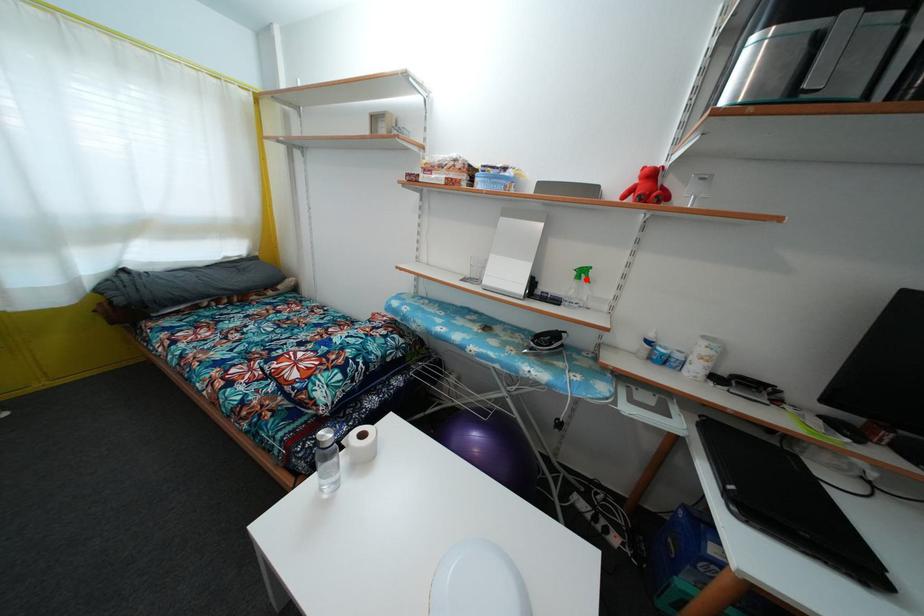
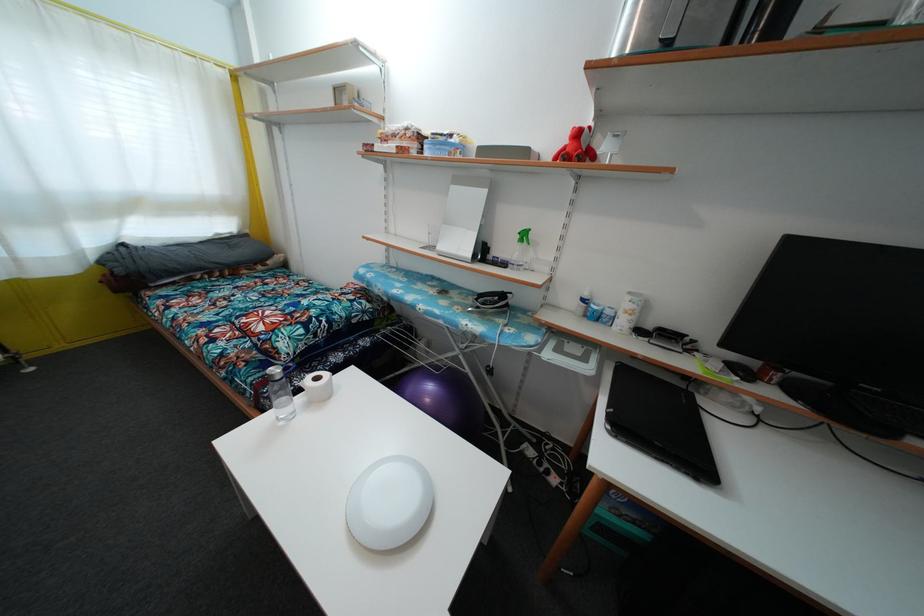
Find the pixel in the second image that matches the highlighted location in the first image.

(528, 241)